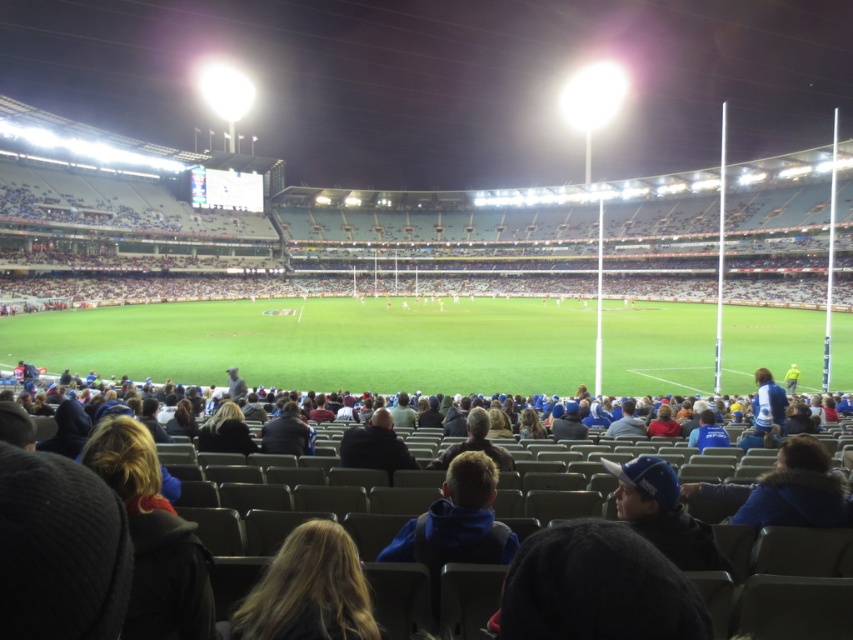
You are sitting in the middle row of the stadium and want to turn around to see if there is space to move past the people in front of you. You notice a blue fleece jacket at center and a dark brown leather jacket at center. Which jacket takes up more space in the row?

The blue fleece jacket at center might be wider than dark brown leather jacket at center, so it could take up more space in the row.